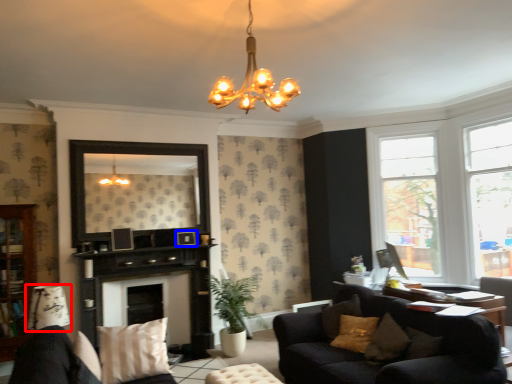
Question: Which object is further to the camera taking this photo, lamp (highlighted by a red box) or picture frame (highlighted by a blue box)?

Choices:
 (A) lamp
 (B) picture frame

Answer: (B)